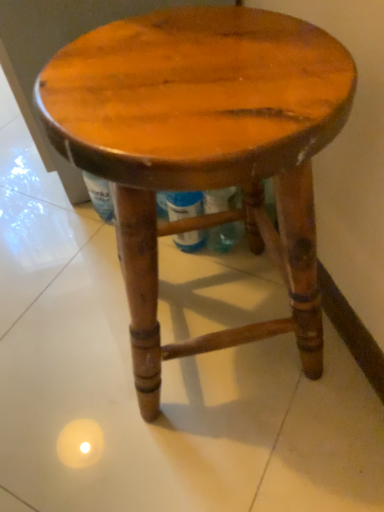
The image size is (384, 512). I want to click on vacant location below wooden stool at center (from a real-world perspective), so click(x=206, y=325).